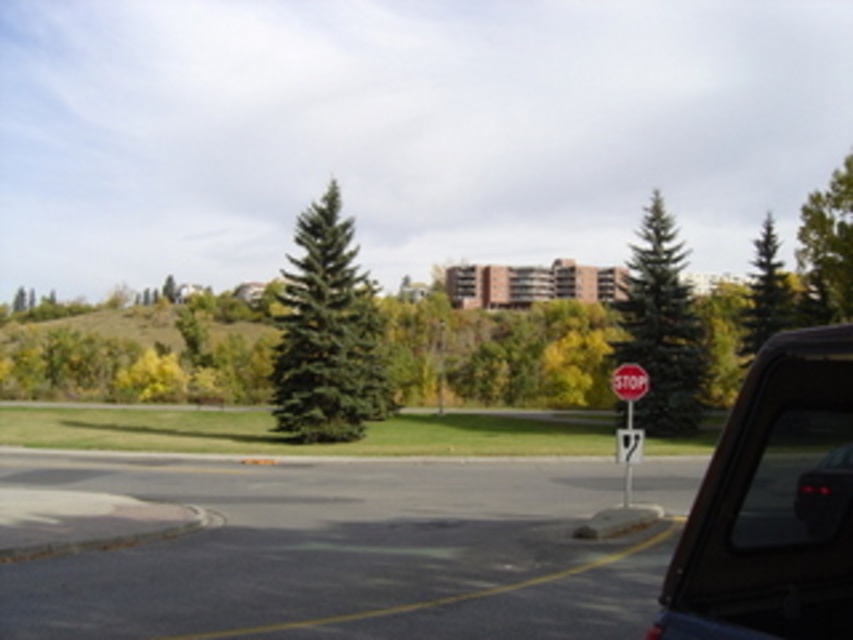
Is green textured pine tree at right to the left of red plastic stop sign at center right from the viewer's perspective?

Incorrect, green textured pine tree at right is not on the left side of red plastic stop sign at center right.

Is green textured pine tree at right further to the viewer compared to red plastic stop sign at center right?

Yes, it is.

Between point (683, 348) and point (647, 388), which one is positioned in front?

Point (647, 388)

Where is `green textured pine tree at right`? green textured pine tree at right is located at coordinates (660, 330).

Between point (749, 346) and point (845, 506), which one is positioned in front?

Point (845, 506) is more forward.

Is green matte tree at upper right shorter than black glossy car at lower right?

In fact, green matte tree at upper right may be taller than black glossy car at lower right.

Measure the distance between point (747, 321) and camera.

The distance of point (747, 321) from camera is 51.93 meters.

Image resolution: width=853 pixels, height=640 pixels. I want to click on green matte tree at upper right, so click(764, 294).

Between green matte tree at center and red plastic stop sign at center right, which one is positioned lower?

red plastic stop sign at center right is below.

Does green matte tree at center have a lesser width compared to red plastic stop sign at center right?

Indeed, green matte tree at center has a lesser width compared to red plastic stop sign at center right.

Based on the photo, who is more forward, (291, 320) or (625, 380)?

Positioned in front is point (625, 380).

Identify the location of green matte tree at center. The width and height of the screenshot is (853, 640). (328, 333).